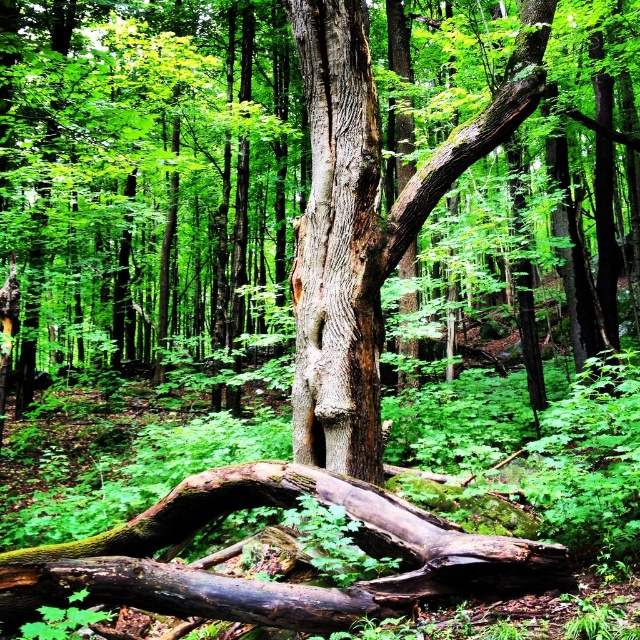
Question: Is the position of brown rough log at center more distant than that of smooth brown tree trunk at center?

Choices:
 (A) yes
 (B) no

Answer: (B)

Question: Which object is farther from the camera taking this photo?

Choices:
 (A) smooth brown tree trunk at center
 (B) brown rough log at center

Answer: (A)

Question: Can you confirm if brown rough log at center is bigger than smooth brown tree trunk at center?

Choices:
 (A) yes
 (B) no

Answer: (A)

Question: Which of the following is the closest to the observer?

Choices:
 (A) smooth brown tree trunk at center
 (B) brown rough log at center

Answer: (B)

Question: Does brown rough log at center appear under smooth brown tree trunk at center?

Choices:
 (A) no
 (B) yes

Answer: (B)